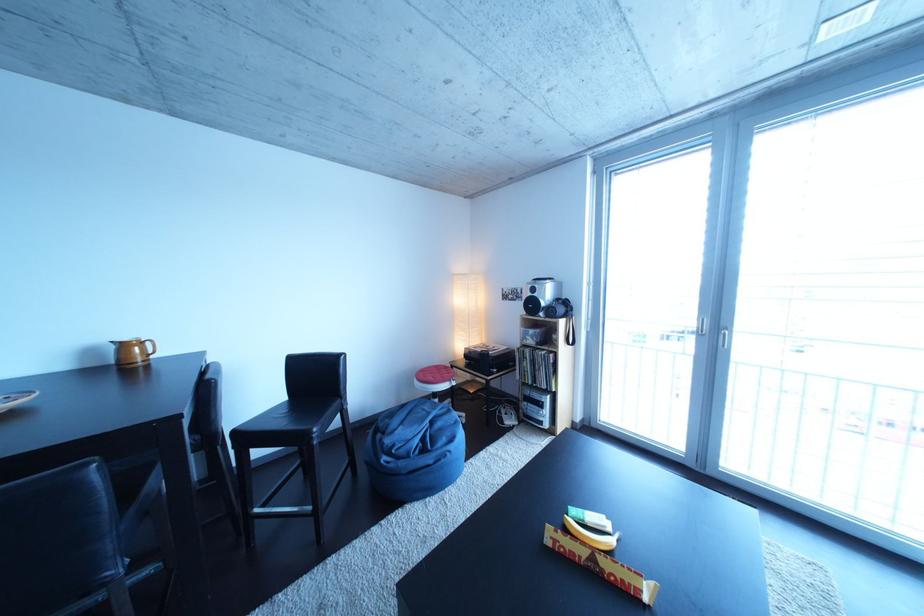
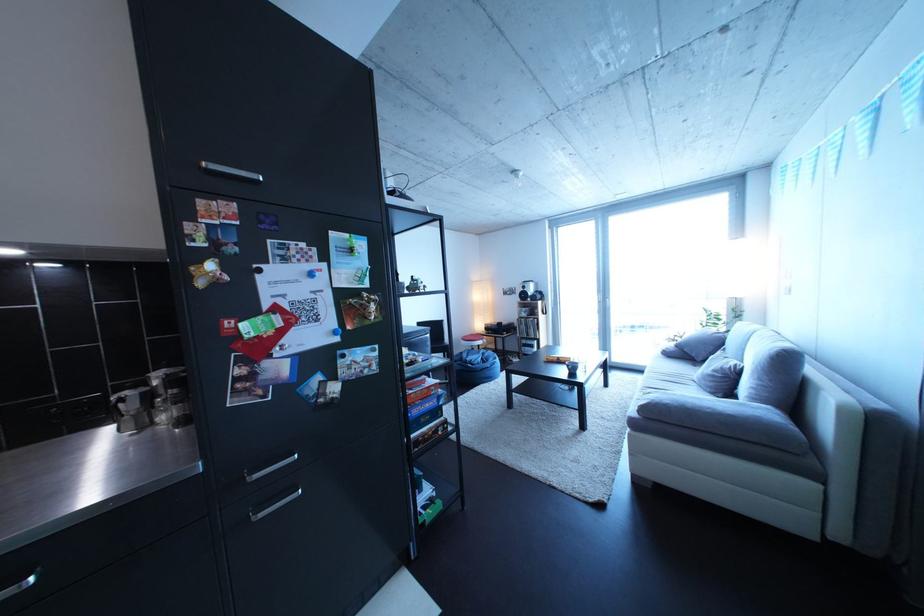
Question: I am providing you with two images of the same scene from different viewpoints. After the viewpoint changes to image2, which objects are now occluded?

Choices:
 (A) red board game box
 (B) blue bean bag chair
 (C) black chair sitting surface
 (D) small glass bowl

Answer: (C)